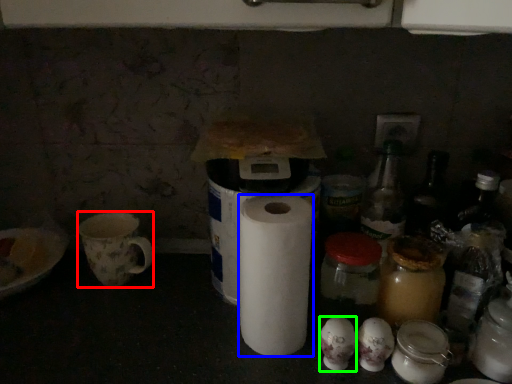
Question: Based on their relative distances, which object is farther from mug (highlighted by a red box)? Choose from paper towel (highlighted by a blue box) and toilet paper (highlighted by a green box).

Choices:
 (A) paper towel
 (B) toilet paper

Answer: (B)